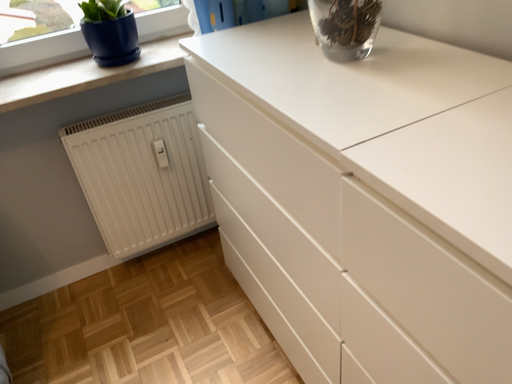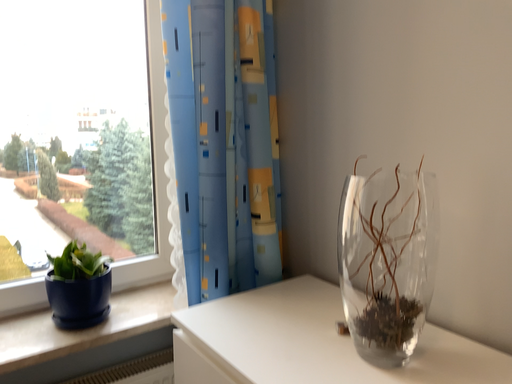
Question: Which way did the camera rotate in the video?

Choices:
 (A) rotated downward
 (B) rotated upward

Answer: (B)